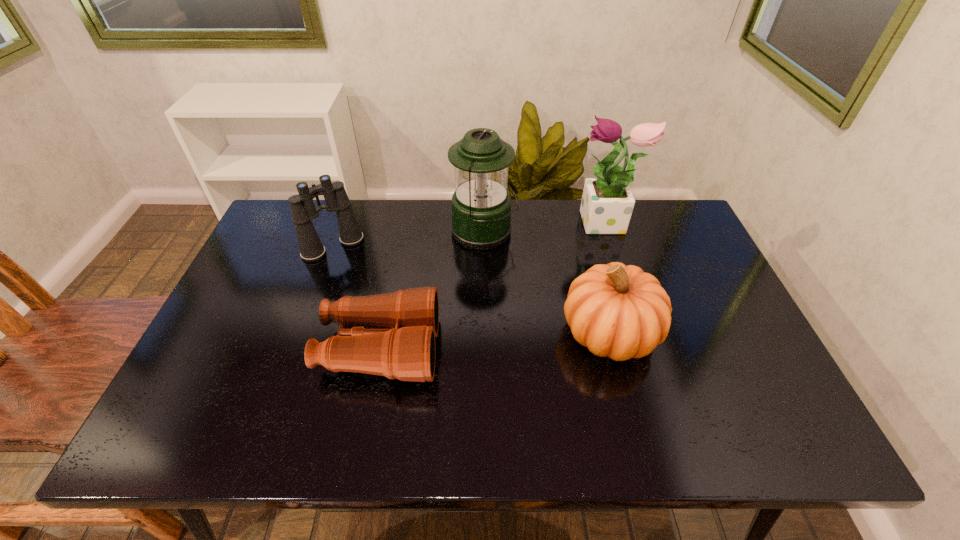
Identify the location of flower arrangement. The height and width of the screenshot is (540, 960). (607, 203).

This screenshot has height=540, width=960. I want to click on lantern, so click(481, 205).

The width and height of the screenshot is (960, 540). I want to click on the farther binoculars, so [303, 210].

Locate an element on the screen. The height and width of the screenshot is (540, 960). pumpkin is located at coordinates (619, 311).

You are a GUI agent. You are given a task and a screenshot of the screen. Output one action in this format:
    pyautogui.click(x=<x>, y=<y>)
    Task: Click on the nearer binoculars
    The width and height of the screenshot is (960, 540).
    Given the screenshot: What is the action you would take?
    (393, 334)

At what (x,y) coordinates should I click in order to perform the action: click on the shorter binoculars. Please return your answer as a coordinate pair (x, y). This screenshot has width=960, height=540. Looking at the image, I should click on (393, 334).

Locate an element on the screen. This screenshot has height=540, width=960. free space located on the front-facing side of the flower arrangement is located at coordinates (497, 225).

At what (x,y) coordinates should I click in order to perform the action: click on vacant space situated 0.160m on the front-facing side of the flower arrangement. Please return your answer as a coordinate pair (x, y). This screenshot has height=540, width=960. Looking at the image, I should click on (525, 225).

Where is `vacant space located 0.290m on the front-facing side of the flower arrangement`? The height and width of the screenshot is (540, 960). vacant space located 0.290m on the front-facing side of the flower arrangement is located at coordinates (485, 225).

This screenshot has width=960, height=540. In order to click on free space located 0.090m on the right of the third object from left to right in this screenshot , I will do `click(546, 233)`.